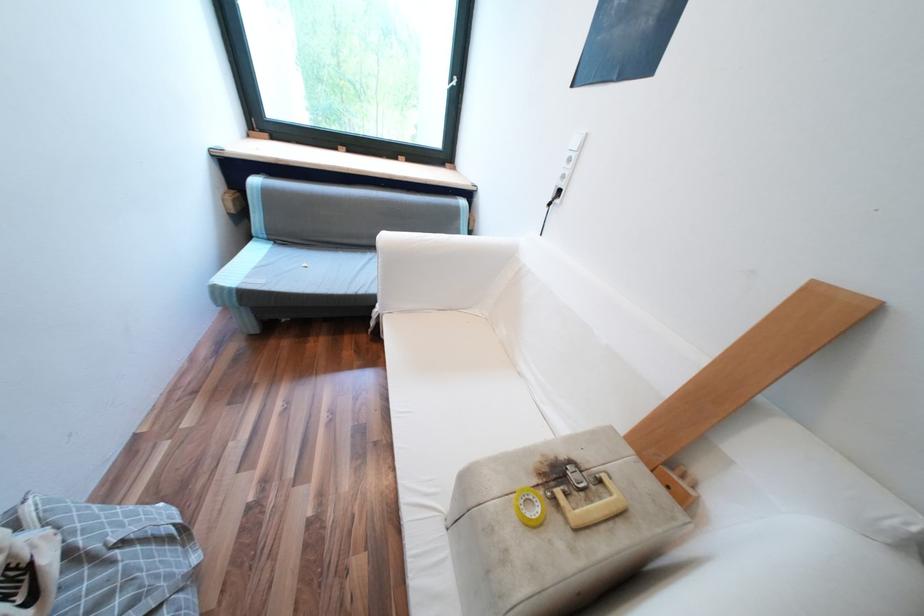
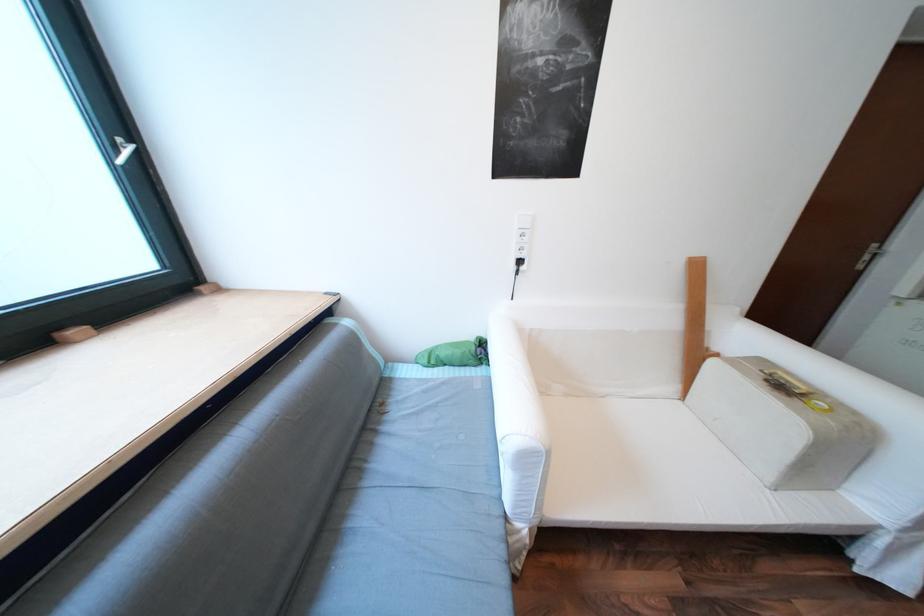
Where in the second image is the point corresponding to (565,500) from the first image?

(811, 394)